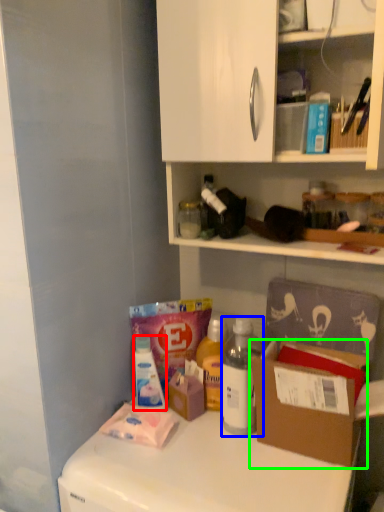
Question: Based on their relative distances, which object is farther from bottle (highlighted by a red box)? Choose from bottle (highlighted by a blue box) and cardboard box (highlighted by a green box).

Choices:
 (A) bottle
 (B) cardboard box

Answer: (B)